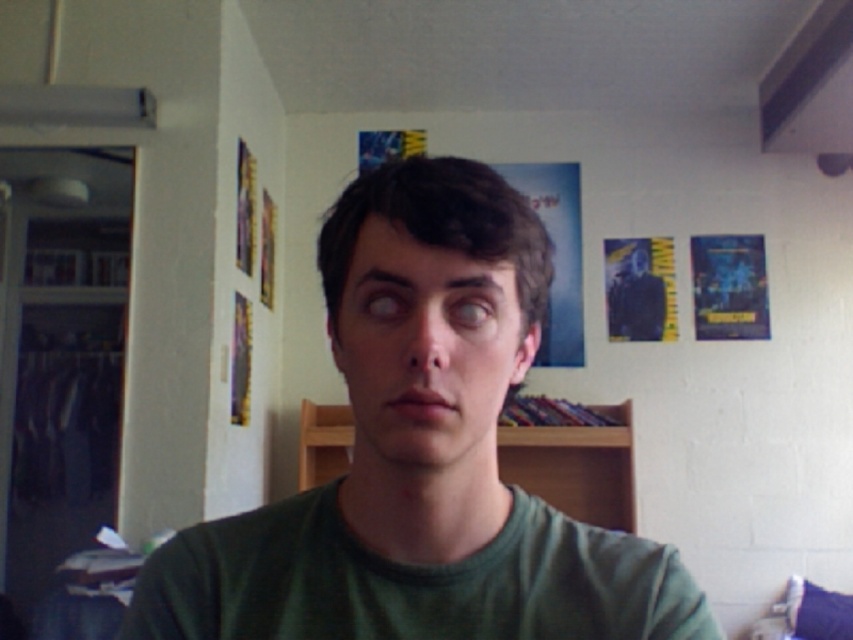
You are standing in the room and want to place a small plant between the green matte shirt at center and the wooden bookshelf at center. Based on their positions, where should the plant be placed?

The green matte shirt at center is to the left of the wooden bookshelf at center, so the plant should be placed between them, to the right of the green matte shirt at center and to the left of the wooden bookshelf at center.

You are a delivery robot that is 2 feet wide. You are in a room and need to move from the green matte shirt at center to the wooden bookshelf at center. Can you navigate the path between them without any obstacles?

The distance between the green matte shirt at center and the wooden bookshelf at center is 9.56 feet, so yes, the robot can navigate the path between them since the distance is sufficient and there are no mentioned obstacles in the scene description.